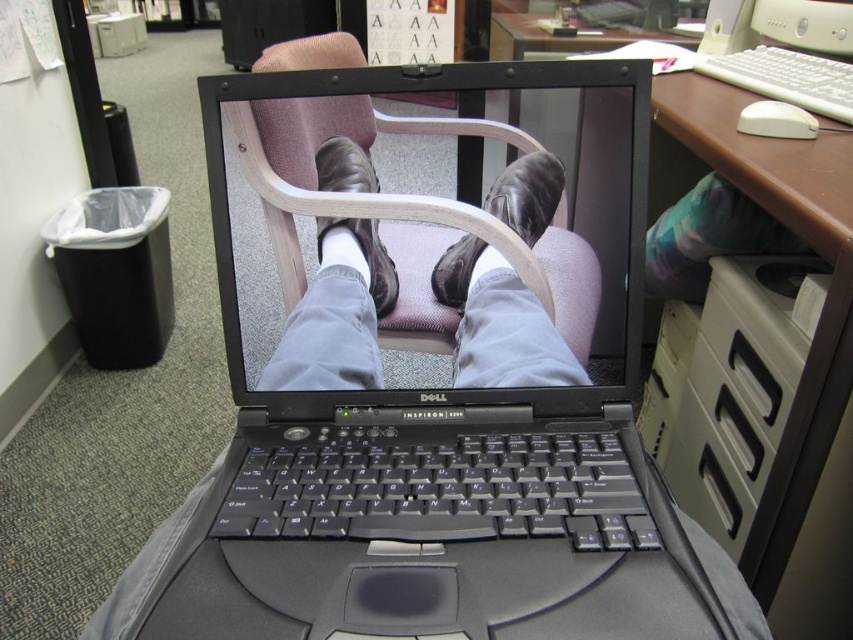
Question: In this image, where is black plastic laptop at center located relative to wooden desk at upper right?

Choices:
 (A) right
 (B) left

Answer: (B)

Question: Among these points, which one is farthest from the camera?

Choices:
 (A) (x=448, y=264)
 (B) (x=833, y=394)

Answer: (B)

Question: Can you confirm if black plastic laptop at center is bigger than leather at center?

Choices:
 (A) yes
 (B) no

Answer: (A)

Question: Estimate the real-world distances between objects in this image. Which object is closer to the leather at center?

Choices:
 (A) black matte laptop at center
 (B) brown leather shoe at center
 (C) wooden desk at upper right
 (D) black plastic laptop at center

Answer: (A)

Question: Does black matte laptop at center come in front of leather at center?

Choices:
 (A) yes
 (B) no

Answer: (A)

Question: Among these objects, which one is nearest to the camera?

Choices:
 (A) wooden desk at upper right
 (B) leather at center

Answer: (A)